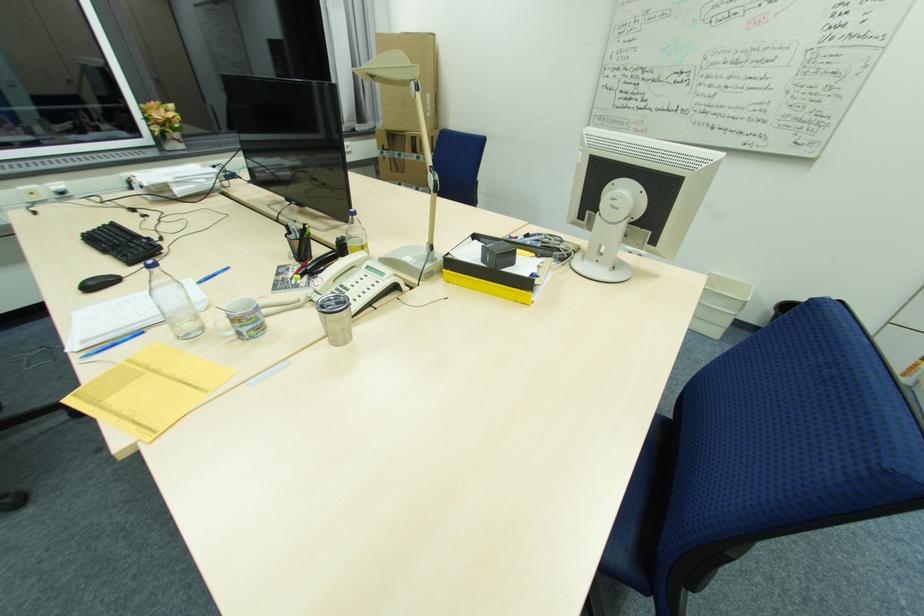
You are a GUI agent. You are given a task and a screenshot of the screen. Output one action in this format:
    pyautogui.click(x=<x>, y=<y>)
    Task: Click on the desk lamp head
    The width and height of the screenshot is (924, 616).
    Given the screenshot: What is the action you would take?
    pyautogui.click(x=388, y=69)